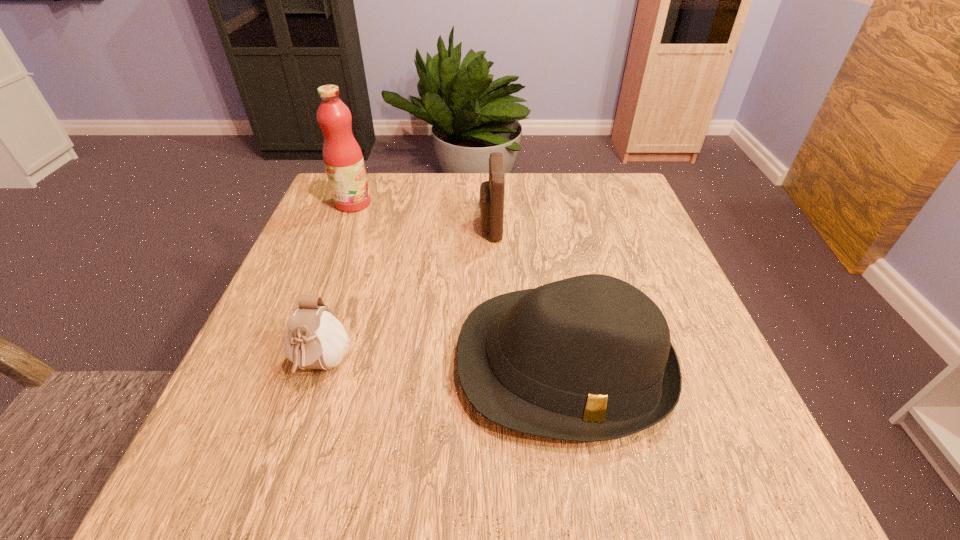
Find the location of a particular element. Image resolution: width=960 pixels, height=540 pixels. the tallest object is located at coordinates (342, 156).

Where is `the right pouch`? The width and height of the screenshot is (960, 540). the right pouch is located at coordinates (491, 202).

Locate an element on the screen. The image size is (960, 540). the taller pouch is located at coordinates pyautogui.click(x=491, y=202).

This screenshot has width=960, height=540. I want to click on fedora, so click(589, 358).

Locate an element on the screen. the shorter pouch is located at coordinates (315, 339).

Image resolution: width=960 pixels, height=540 pixels. I want to click on the left pouch, so click(x=315, y=339).

Image resolution: width=960 pixels, height=540 pixels. What are the coordinates of `free space located 0.230m on the front label of the fruit juice` in the screenshot? It's located at (460, 203).

The image size is (960, 540). Find the location of `blank space located 0.080m with an open flap on the farther pouch`. blank space located 0.080m with an open flap on the farther pouch is located at coordinates (446, 227).

Identify the location of vacant space situated 0.310m with an open flap on the farther pouch. (351, 227).

Locate an element on the screen. The height and width of the screenshot is (540, 960). free region located with an open flap on the farther pouch is located at coordinates pyautogui.click(x=384, y=227).